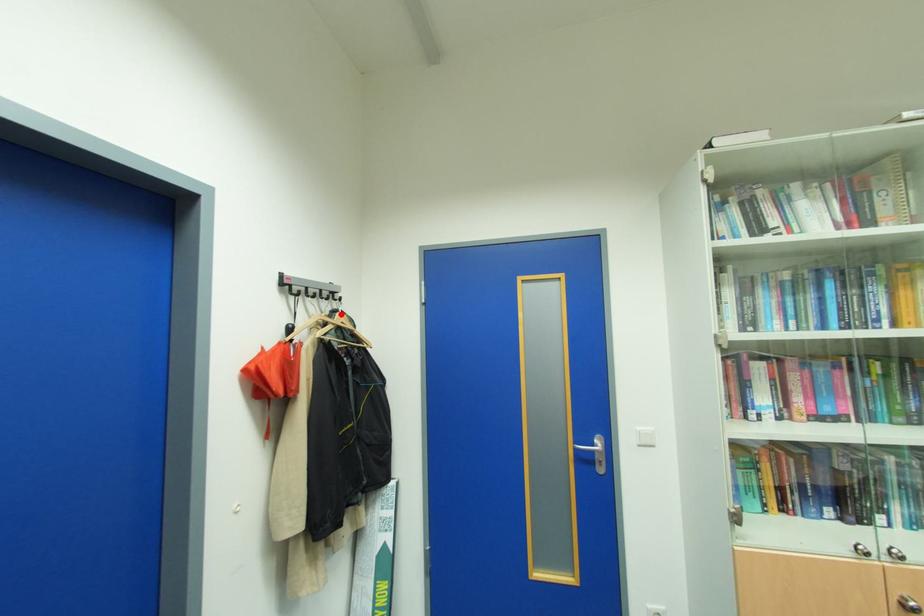
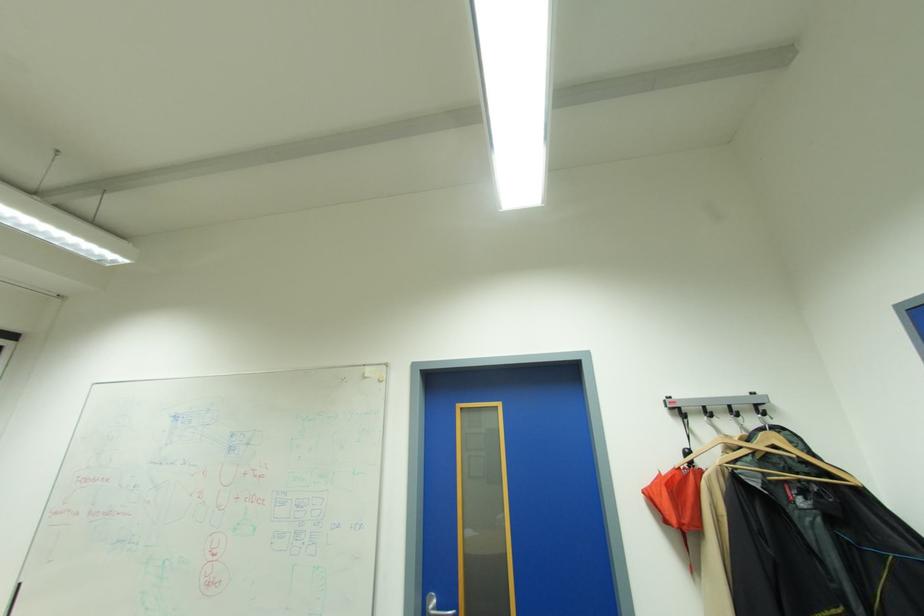
The point at the highlighted location is marked in the first image. Where is the corresponding point in the second image?

(764, 434)